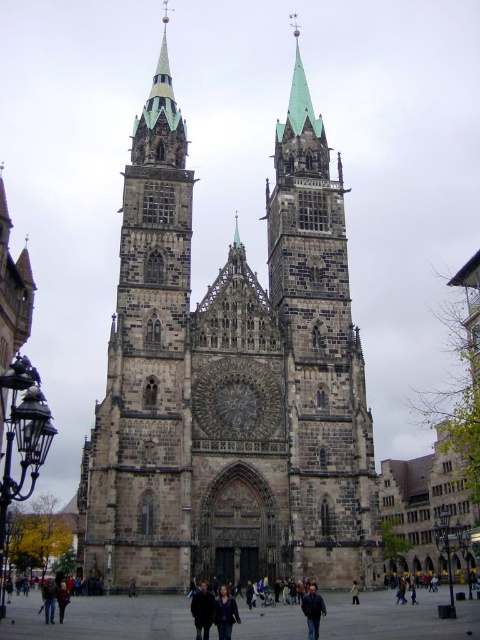
Question: Which object is closer to the camera taking this photo?

Choices:
 (A) dark blue jeans at lower center
 (B) dark brown leather jacket at lower center
 (C) stone gothic cathedral at center
 (D) yellow fabric person at center

Answer: (B)

Question: Does dark brown leather coat at center come behind dark brown leather jacket at lower center?

Choices:
 (A) no
 (B) yes

Answer: (A)

Question: Which point is farther to the camera?

Choices:
 (A) (315, 625)
 (B) (279, 388)
 (C) (358, 598)

Answer: (B)

Question: Does dark blue jeans at lower center appear over yellow fabric person at center?

Choices:
 (A) no
 (B) yes

Answer: (B)

Question: Does dark gray stone town square at center have a smaller size compared to dark brown stone clock at center?

Choices:
 (A) yes
 (B) no

Answer: (B)

Question: Which object appears closest to the camera in this image?

Choices:
 (A) dark brown leather coat at center
 (B) dark brown stone clock at center
 (C) dark blue jeans at lower center

Answer: (A)